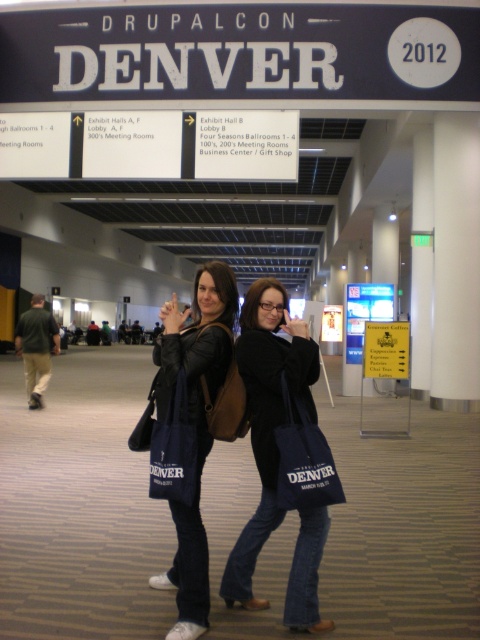
Question: Considering the real-world distances, which object is farthest from the dark blue canvas bag at center?

Choices:
 (A) matte black jacket at center
 (B) matte black tote bag at center

Answer: (A)

Question: Which object is closer to the camera taking this photo?

Choices:
 (A) matte black jacket at center
 (B) matte black tote bag at center
 (C) dark blue canvas bag at center

Answer: (C)

Question: Is matte black jacket at center behind dark blue canvas bag at center?

Choices:
 (A) no
 (B) yes

Answer: (B)

Question: Is matte black jacket at center wider than dark blue canvas bag at center?

Choices:
 (A) yes
 (B) no

Answer: (A)

Question: Can you confirm if matte black tote bag at center is wider than matte black jacket at center?

Choices:
 (A) yes
 (B) no

Answer: (B)

Question: Which object is farther from the camera taking this photo?

Choices:
 (A) matte black jacket at center
 (B) matte black tote bag at center

Answer: (A)